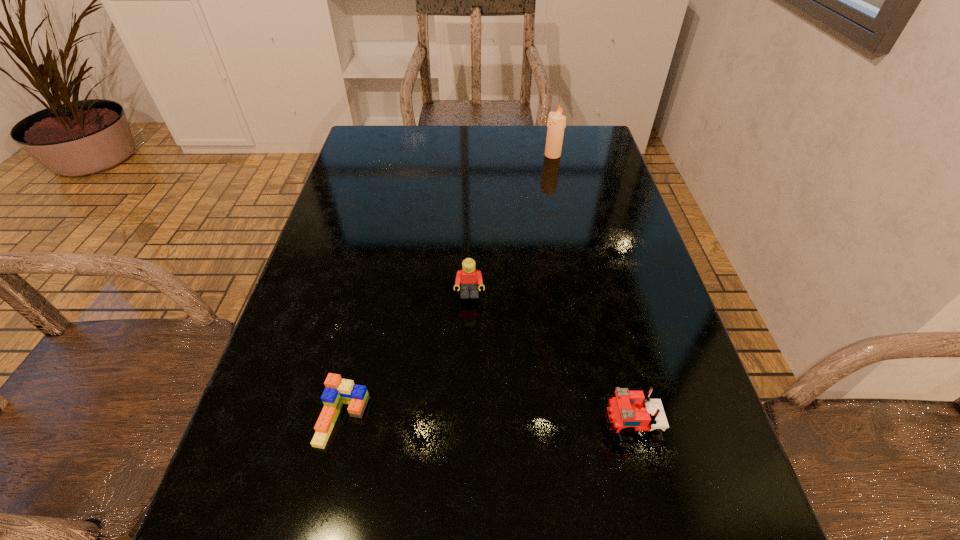
Locate an element on the screen. Image resolution: width=960 pixels, height=540 pixels. free space between the farthest Lego and the shortest Lego is located at coordinates (406, 357).

The image size is (960, 540). In order to click on free space that is in between the second Lego from right to left and the rightmost Lego in this screenshot , I will do `click(550, 361)`.

Where is `unoccupied position between the rightmost Lego and the second object from left to right`? The image size is (960, 540). unoccupied position between the rightmost Lego and the second object from left to right is located at coordinates (550, 361).

Identify which object is the nearest to the second object from left to right. Please provide its 2D coordinates. Your answer should be formatted as a tuple, i.e. [(x, y)], where the tuple contains the x and y coordinates of a point satisfying the conditions above.

[(338, 391)]

Identify which object is the third nearest to the rightmost Lego. Please provide its 2D coordinates. Your answer should be formatted as a tuple, i.e. [(x, y)], where the tuple contains the x and y coordinates of a point satisfying the conditions above.

[(556, 124)]

Locate an element on the screen. Lego that stands as the closest to the shortest Lego is located at coordinates (469, 279).

Point out which Lego is positioned as the nearest to the candle. Please provide its 2D coordinates. Your answer should be formatted as a tuple, i.e. [(x, y)], where the tuple contains the x and y coordinates of a point satisfying the conditions above.

[(469, 279)]

Identify the location of free space that satisfies the following two spatial constraints: 1. on the back side of the tallest object; 2. on the right side of the leftmost object. (403, 155).